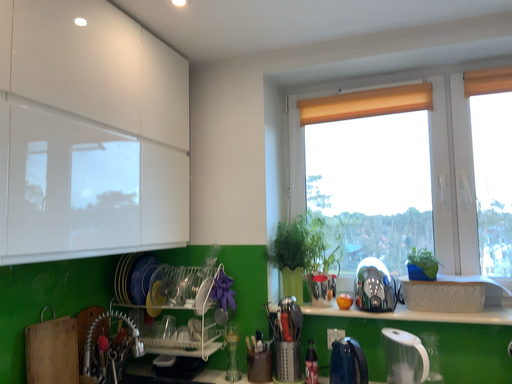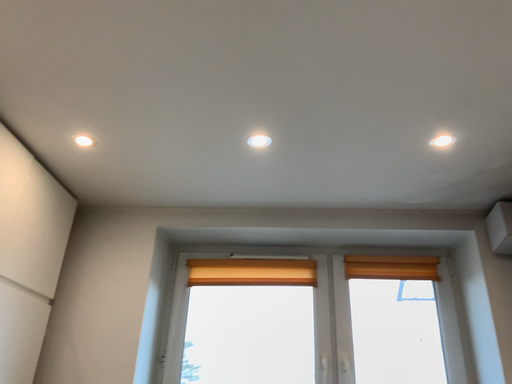
Question: How did the camera likely rotate when shooting the video?

Choices:
 (A) rotated upward
 (B) rotated downward

Answer: (A)